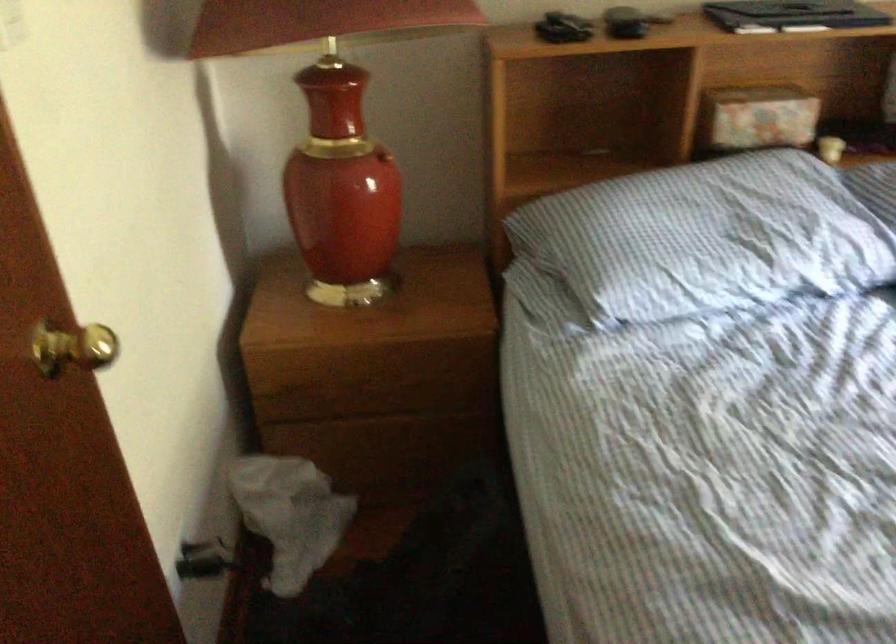
The height and width of the screenshot is (644, 896). In order to click on black electrical plug in this screenshot , I will do `click(204, 560)`.